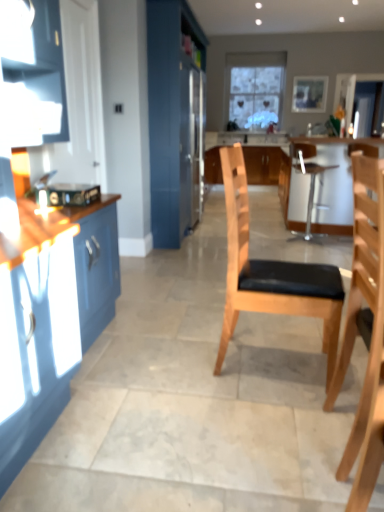
Identify the location of vacant space underneath light wood/black cushioned chair at center, positioned as the 2th chair in front-to-back order (from a real-world perspective). This screenshot has height=512, width=384. (273, 362).